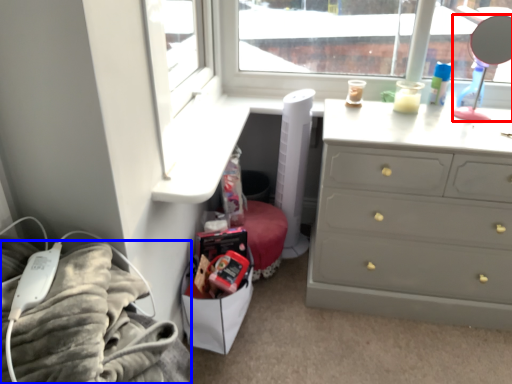
Question: Which object is closer to the camera taking this photo, mirror (highlighted by a red box) or bedding (highlighted by a blue box)?

Choices:
 (A) mirror
 (B) bedding

Answer: (B)